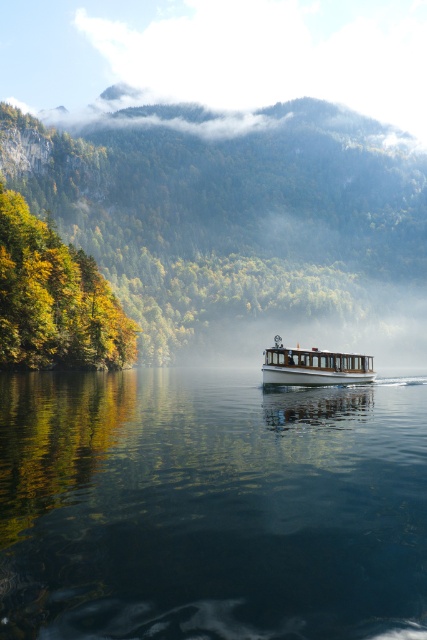
Which is more to the left, transparent glass water at center or white wooden boat at center?

transparent glass water at center

Can you confirm if transparent glass water at center is positioned above white wooden boat at center?

Actually, transparent glass water at center is below white wooden boat at center.

Locate an element on the screen. The image size is (427, 640). transparent glass water at center is located at coordinates (210, 508).

I want to click on transparent glass water at center, so pyautogui.click(x=210, y=508).